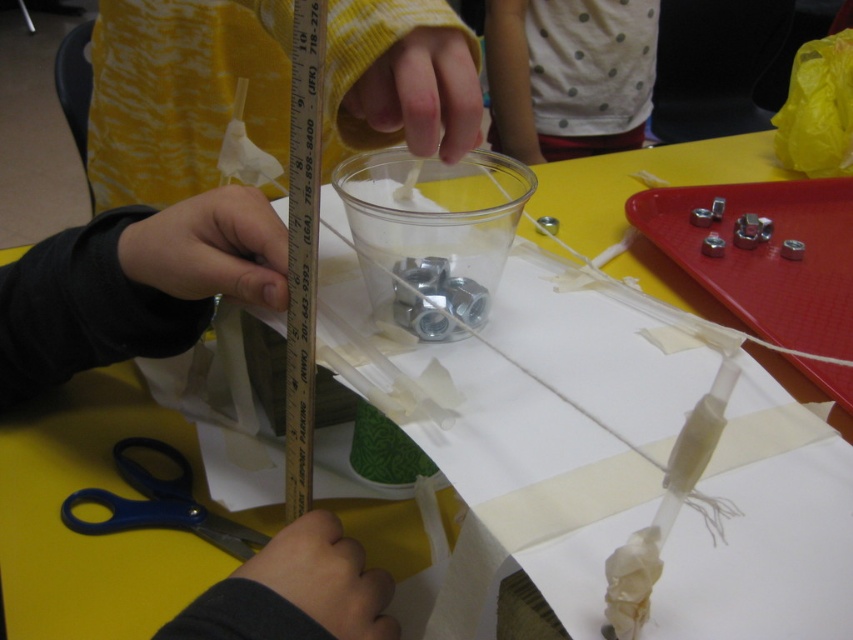
You are a teacher observing a classroom activity. You notice the white dotted fabric at upper center and the blue plastic scissors at lower left. Which object is located higher in the image?

The white dotted fabric at upper center is positioned over the blue plastic scissors at lower left, so it is higher in the image.

From the picture: You are a student participating in the activity and need to determine which of the two points, point (129,36) or point (579,17), is closer to you. Based on the scene, which point should you choose?

Point (129,36) is closer to the camera than point (579,17), so you should choose point (129,36) as it is nearer to you.